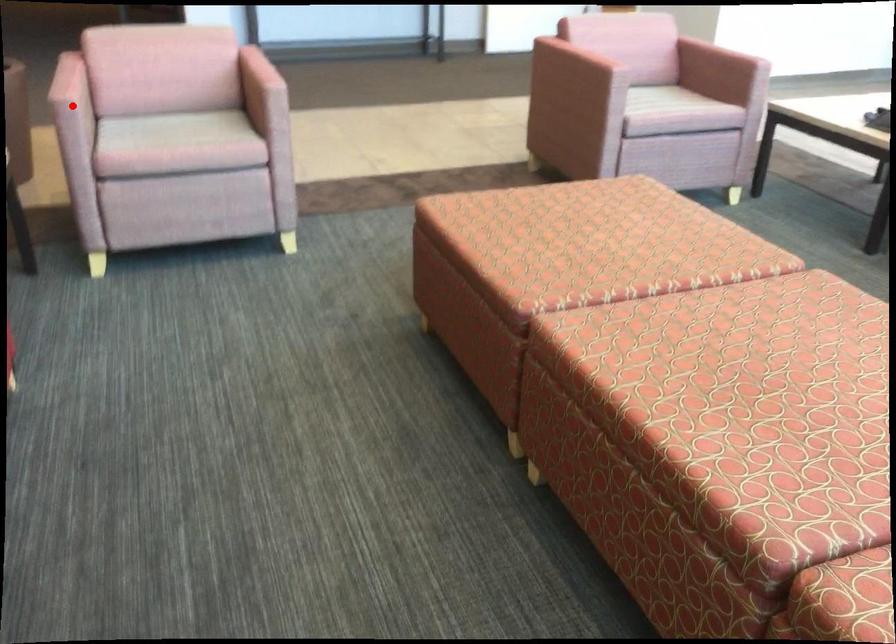
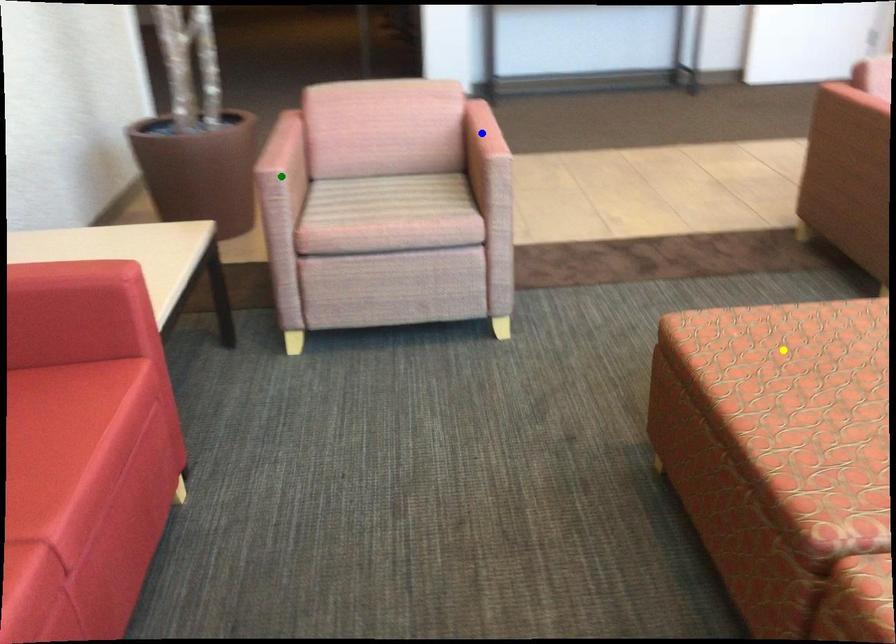
Question: I am providing you with two images of the same scene from different viewpoints. A red point is marked on the first image. You are given multiple points on the second image. Which point in image 2 is actually the same real-world point as the red point in image 1?

Choices:
 (A) blue point
 (B) green point
 (C) yellow point

Answer: (B)